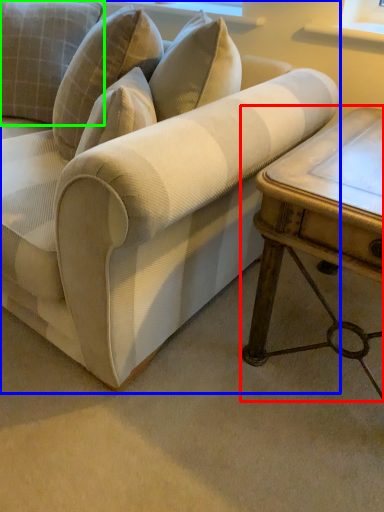
Question: Which is farther away from table (highlighted by a red box)? studio couch (highlighted by a blue box) or pillow (highlighted by a green box)?

Choices:
 (A) studio couch
 (B) pillow

Answer: (B)